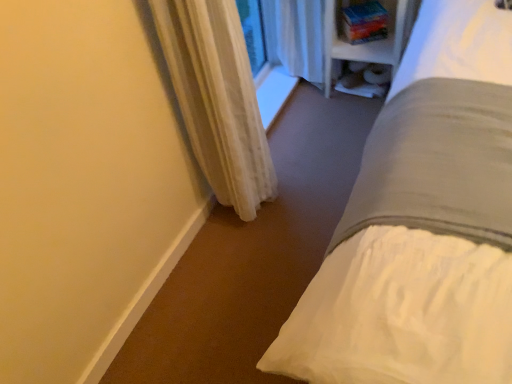
Question: Considering the relative sizes of white sheer curtain at lower left and white fabric shelf at upper right in the image provided, is white sheer curtain at lower left thinner than white fabric shelf at upper right?

Choices:
 (A) yes
 (B) no

Answer: (B)

Question: Considering the relative sizes of white sheer curtain at lower left and white fabric shelf at upper right in the image provided, is white sheer curtain at lower left smaller than white fabric shelf at upper right?

Choices:
 (A) no
 (B) yes

Answer: (A)

Question: Is white sheer curtain at lower left looking in the opposite direction of white fabric shelf at upper right?

Choices:
 (A) no
 (B) yes

Answer: (A)

Question: Is white sheer curtain at lower left not inside white fabric shelf at upper right?

Choices:
 (A) yes
 (B) no

Answer: (A)

Question: Is white sheer curtain at lower left placed right next to white fabric shelf at upper right?

Choices:
 (A) yes
 (B) no

Answer: (B)

Question: Considering the positions of white plastic bookshelf at upper right and white fabric shelf at upper right in the image, is white plastic bookshelf at upper right wider or thinner than white fabric shelf at upper right?

Choices:
 (A) thin
 (B) wide

Answer: (B)

Question: Considering the relative positions of white plastic bookshelf at upper right and white fabric shelf at upper right in the image provided, is white plastic bookshelf at upper right to the left or to the right of white fabric shelf at upper right?

Choices:
 (A) right
 (B) left

Answer: (B)

Question: Is white plastic bookshelf at upper right inside or outside of white fabric shelf at upper right?

Choices:
 (A) outside
 (B) inside

Answer: (A)

Question: From their relative heights in the image, would you say white plastic bookshelf at upper right is taller or shorter than white fabric shelf at upper right?

Choices:
 (A) short
 (B) tall

Answer: (B)

Question: From their relative heights in the image, would you say white sheer curtain at lower left is taller or shorter than white plastic bookshelf at upper right?

Choices:
 (A) short
 (B) tall

Answer: (B)

Question: From a real-world perspective, relative to white plastic bookshelf at upper right, is white sheer curtain at lower left vertically above or below?

Choices:
 (A) above
 (B) below

Answer: (A)

Question: Looking at the image, does white sheer curtain at lower left seem bigger or smaller compared to white plastic bookshelf at upper right?

Choices:
 (A) small
 (B) big

Answer: (A)

Question: Is point (226, 76) closer or farther from the camera than point (391, 18)?

Choices:
 (A) farther
 (B) closer

Answer: (B)

Question: From the image's perspective, is white fabric shelf at upper right above or below white sheer curtain at lower left?

Choices:
 (A) below
 (B) above

Answer: (B)

Question: In terms of height, does white fabric shelf at upper right look taller or shorter compared to white sheer curtain at lower left?

Choices:
 (A) short
 (B) tall

Answer: (A)